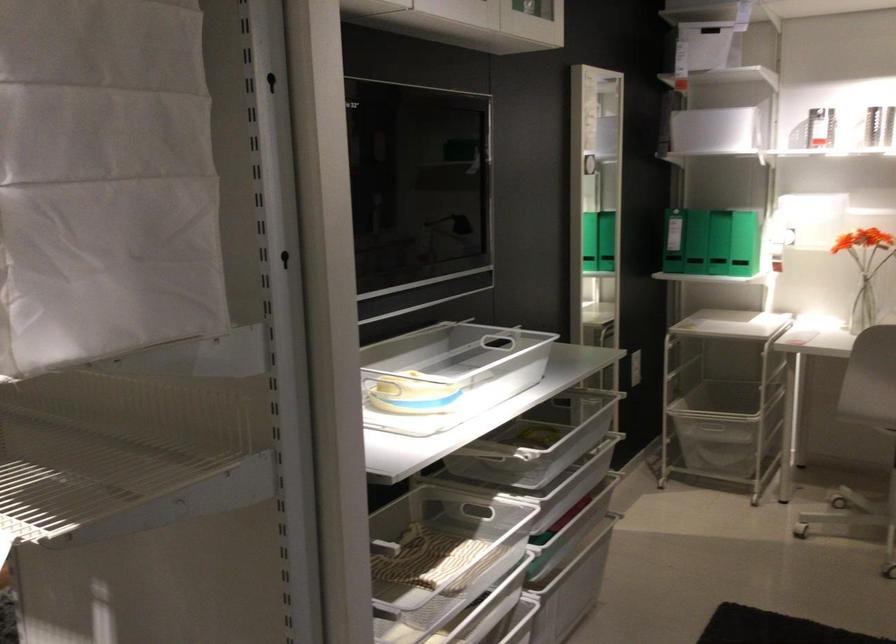
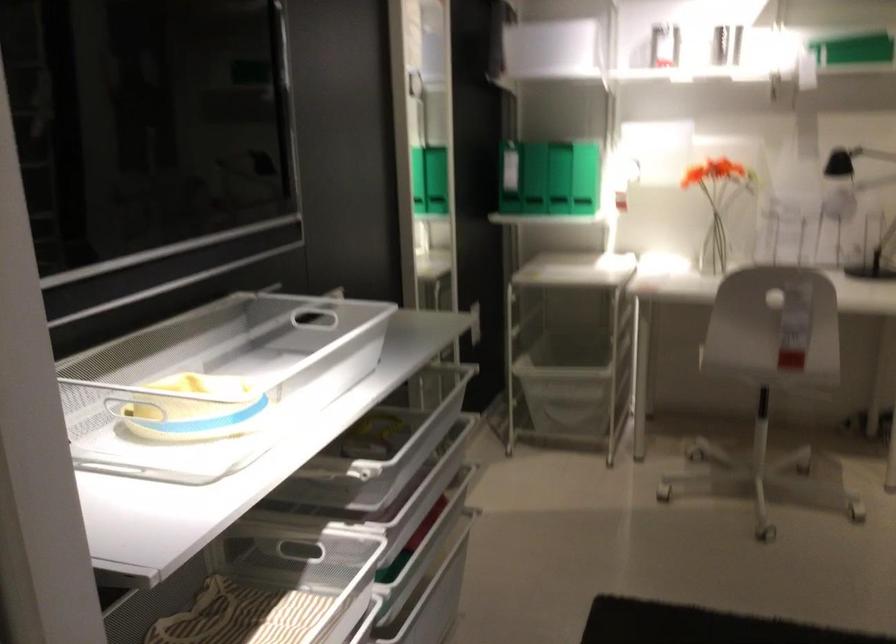
Question: The images are taken continuously from a first-person perspective. In which direction is your viewpoint rotating?

Choices:
 (A) Left
 (B) Right
 (C) Up
 (D) Down

Answer: (B)